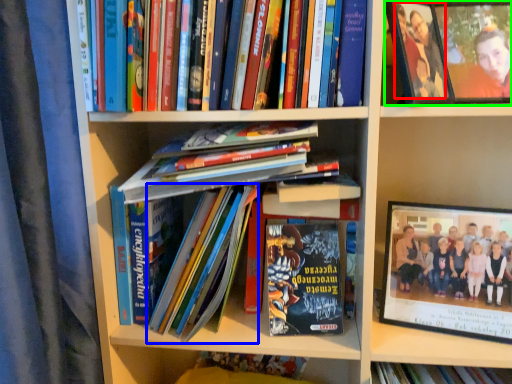
Question: Based on their relative distances, which object is nearer to person (highlighted by a red box)? Choose from book (highlighted by a blue box) and picture frame (highlighted by a green box).

Choices:
 (A) book
 (B) picture frame

Answer: (B)